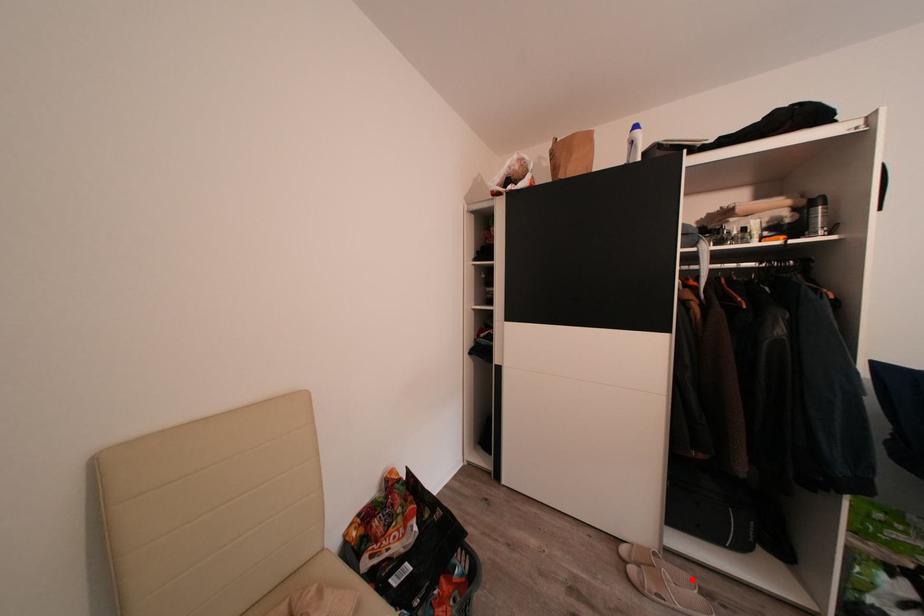
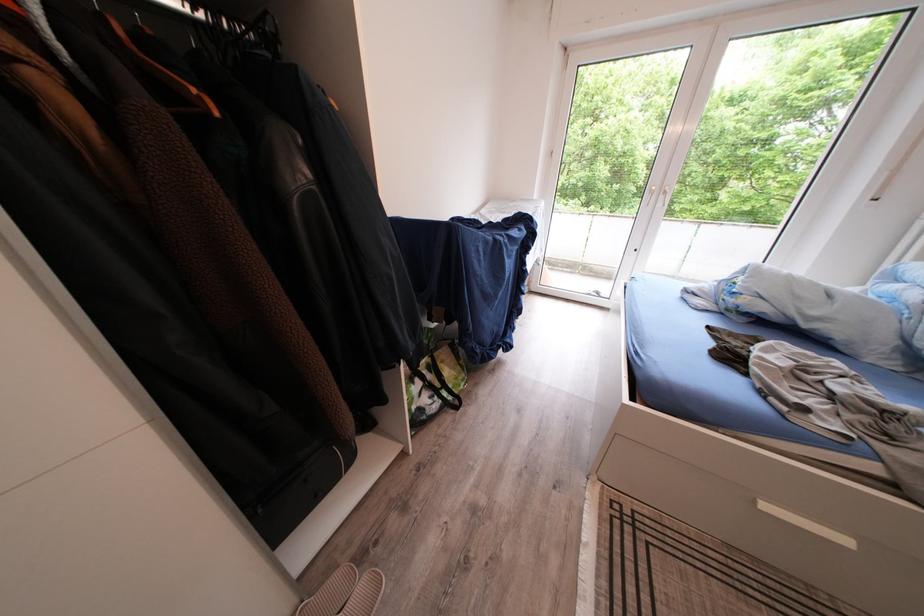
Where in the second image is the point corresponding to the highlighted location from the first image?

(347, 583)